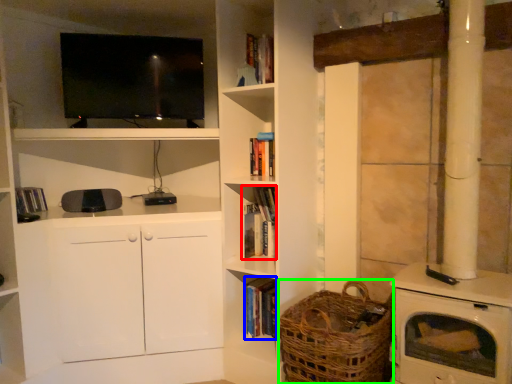
Question: Considering the real-world distances, which object is farthest from book (highlighted by a red box)? book (highlighted by a blue box) or basket (highlighted by a green box)?

Choices:
 (A) book
 (B) basket

Answer: (B)